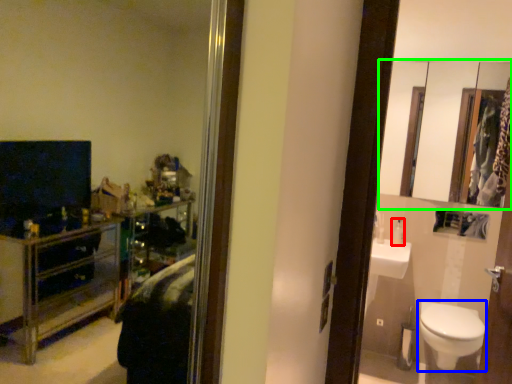
Question: Considering the real-world distances, which object is closest to toiletry (highlighted by a red box)? toilet (highlighted by a blue box) or mirror (highlighted by a green box).

Choices:
 (A) toilet
 (B) mirror

Answer: (A)